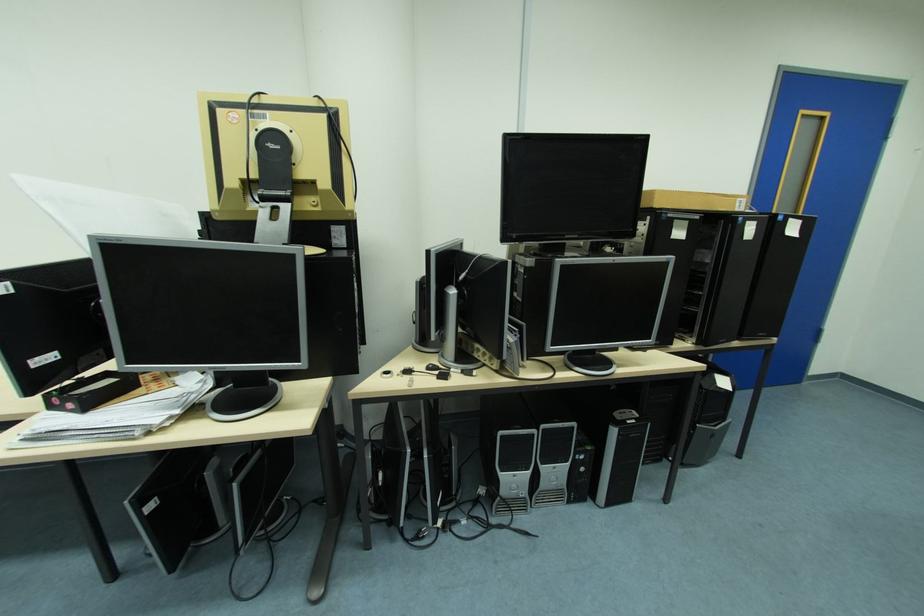
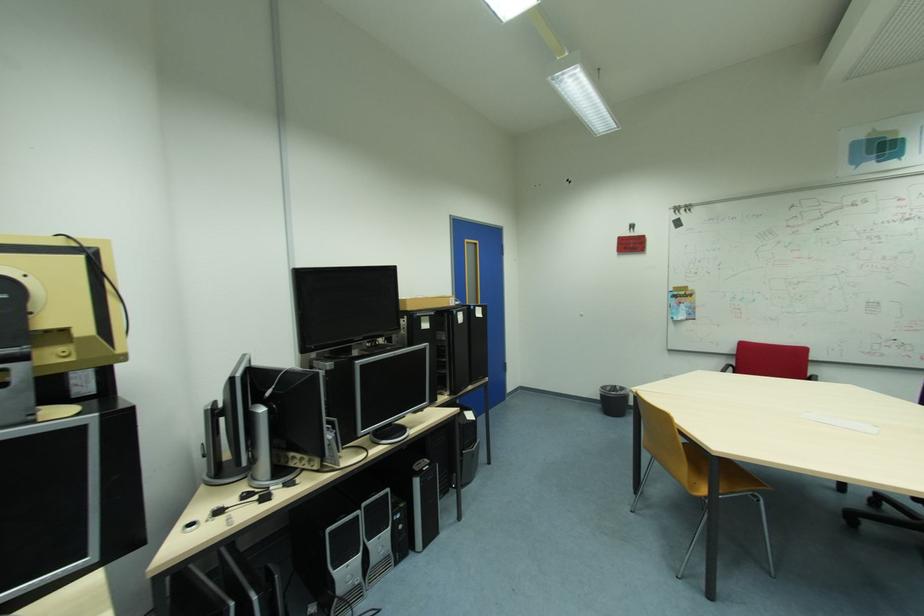
In the second image, find the point that corresponds to the point at 507,434 in the first image.

(335, 530)